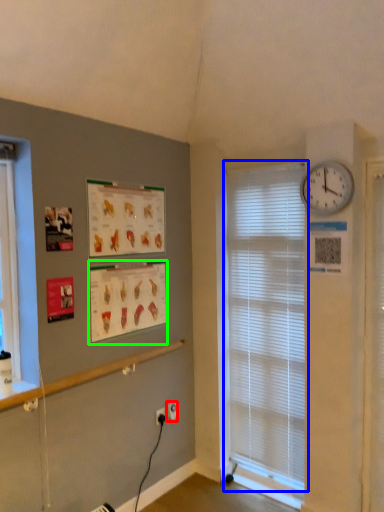
Question: Estimate the real-world distances between objects in this image. Which object is closer to electric outlet (highlighted by a red box), window blind (highlighted by a blue box) or poster page (highlighted by a green box)?

Choices:
 (A) window blind
 (B) poster page

Answer: (B)